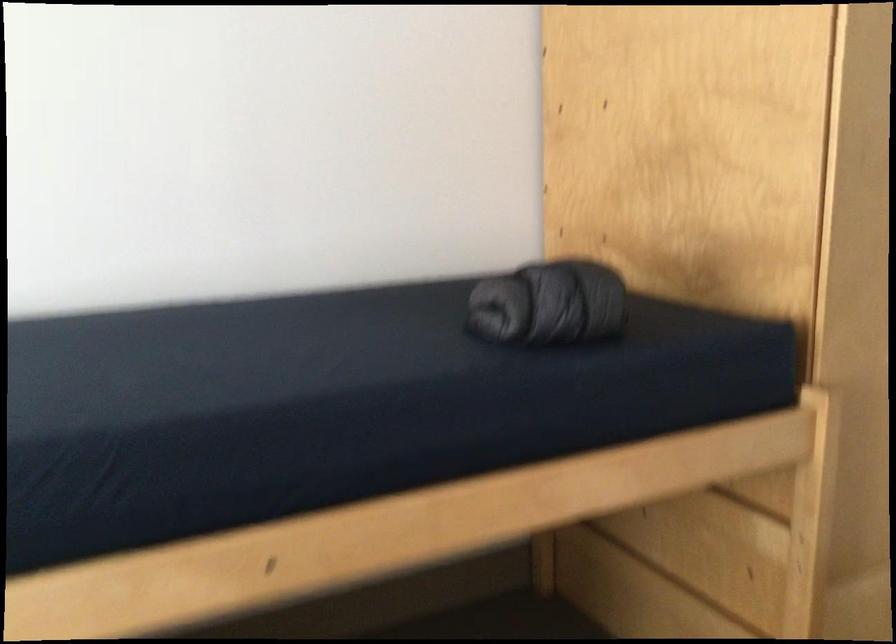
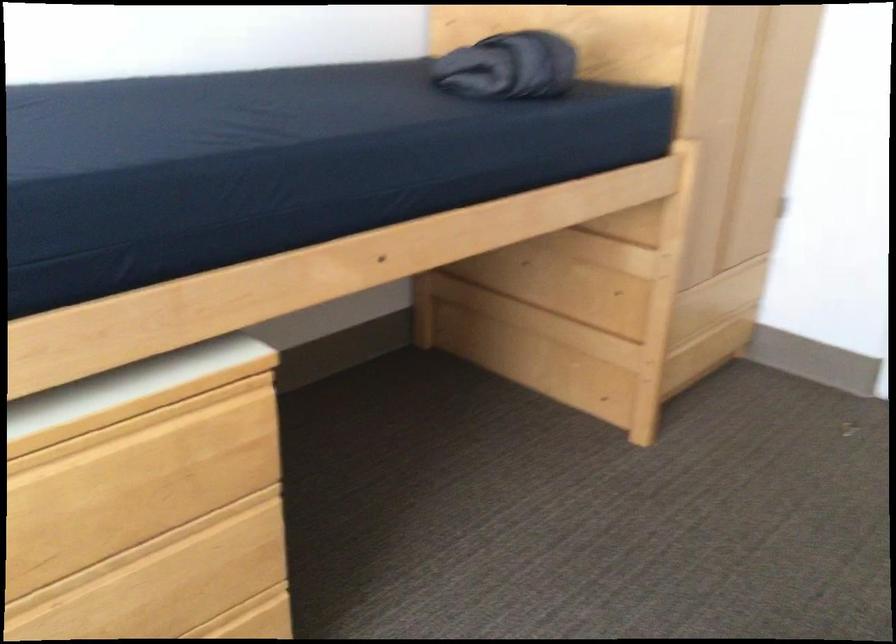
What movement of the cameraman would produce the second image?

The cameraman moved toward left, backward.